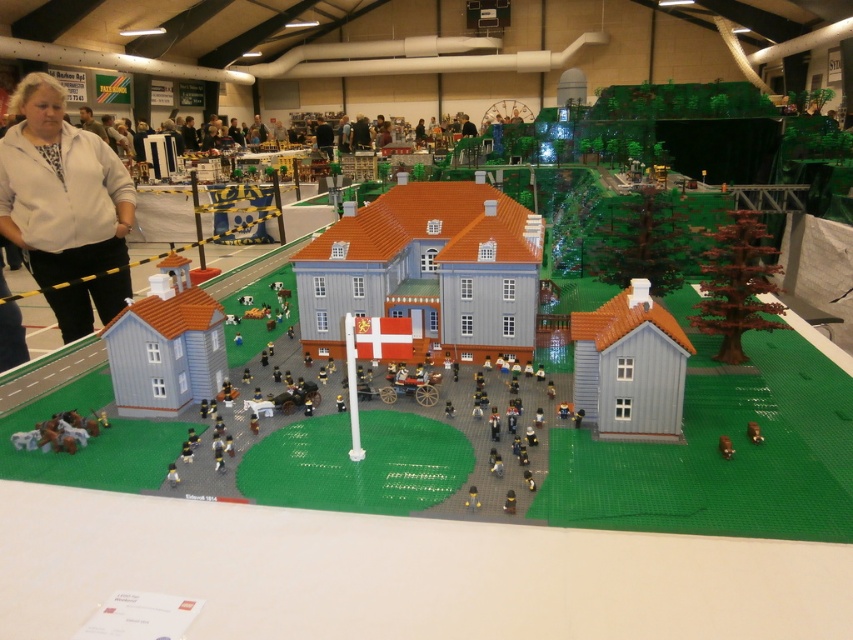
You are a visitor at the Lego exhibition and want to take a photo of the central building with the Danish flagpole. To avoid blocking the view, you need to ensure there are no objects in front of the central building. Are the brown matte toy animals at lower left in front of the central building?

The brown matte toy animals at lower left are located at point (57, 433), which is to the lower left of the central building. Since they are positioned at the lower left and not in front of the central building, they are not blocking the view. You can take the photo without any obstruction.

In the scene shown: You are a Lego enthusiast who wants to place a new decorative item between the matte gray house at lower right and the metallic gold key at center. The item is 10 inches long. Will it fit without overlapping either object?

The distance between the matte gray house at lower right and the metallic gold key at center is 13.38 inches. Since the new item is 10 inches long, there is enough space to place it between them without overlapping either object.

You are a Lego model designer who wants to place the metallic gold key at center between the matte gray house at lower right and a nearby tree. Which object should the key be closer to if it needs to be placed closer to the wider object?

The matte gray house at lower right is wider than the metallic gold key at center. Therefore, the metallic gold key at center should be placed closer to the matte gray house at lower right since it is the wider object.